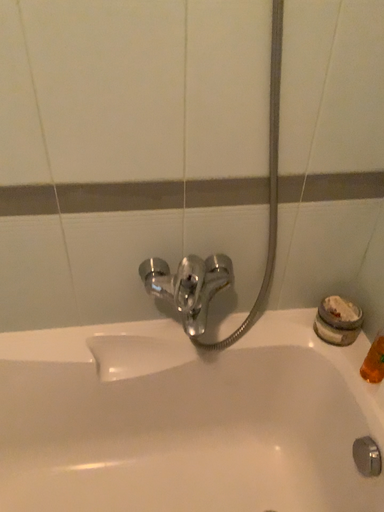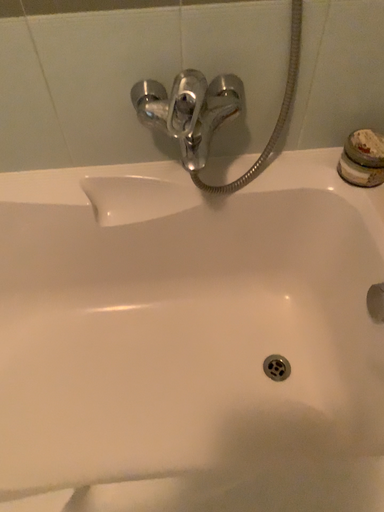
Question: How did the camera likely rotate when shooting the video?

Choices:
 (A) rotated upward
 (B) rotated downward

Answer: (B)